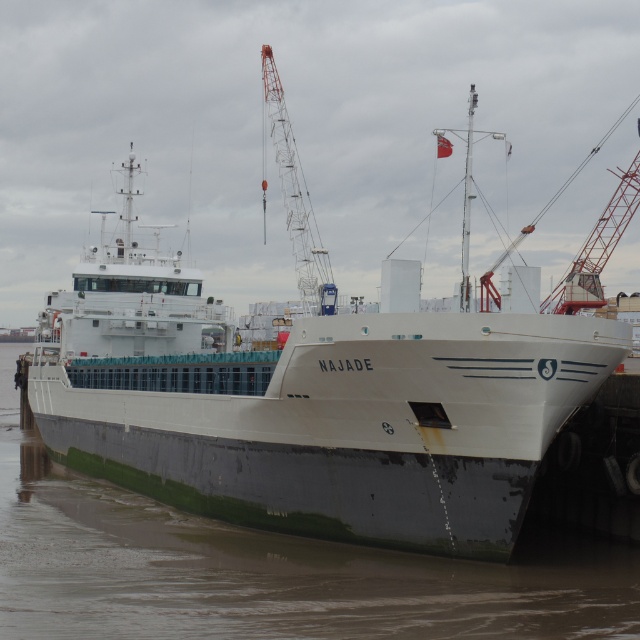
You are standing on the dock and looking at the white matte ship at center and the green matte water at lower left. Which object is closer to you?

The green matte water at lower left is closer to you because it is positioned under the white matte ship at center.

You are a crane operator on the red painted metal crane at center. You need to lower a heavy container into the green matte water at lower left. Can you safely lower it directly in front of the crane without hitting the water?

The green matte water at lower left might be wider than the red painted metal crane at center, so there is a possibility that the crane has enough horizontal space to lower the container safely. However, the exact distance isn

You are standing on the dock and looking at the white matte ship at center and the green matte water at lower left. Which object is closer to you?

The white matte ship at center is closer to you because the green matte water at lower left is behind it.